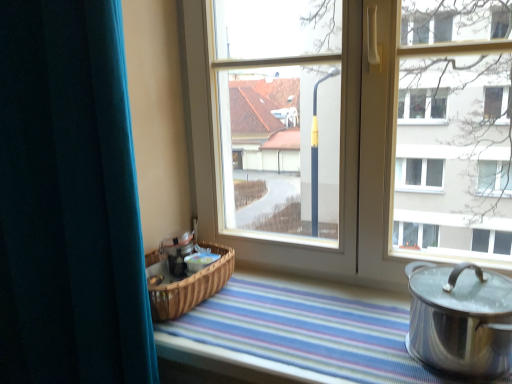
This screenshot has height=384, width=512. What are the coordinates of `vacant space in between polished silver pot at lower right and transparent glass window at center` in the screenshot? It's located at (325, 318).